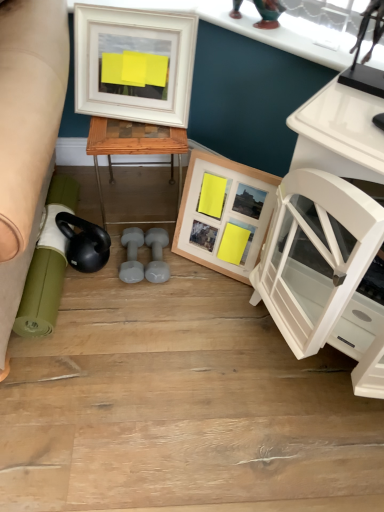
Question: From the image's perspective, is wooden picture frame at center, which is the 2th picture frame from left to right, above white glossy cabinet at right?

Choices:
 (A) yes
 (B) no

Answer: (A)

Question: Is wooden picture frame at center, which ranks as the first picture frame in bottom-to-top order, to the left of white glossy cabinet at right from the viewer's perspective?

Choices:
 (A) no
 (B) yes

Answer: (B)

Question: Does wooden picture frame at center, which ranks as the first picture frame in bottom-to-top order, come behind white glossy cabinet at right?

Choices:
 (A) no
 (B) yes

Answer: (B)

Question: Is wooden picture frame at center, which appears as the second picture frame when viewed from the top, outside white glossy cabinet at right?

Choices:
 (A) no
 (B) yes

Answer: (B)

Question: Could you tell me if wooden picture frame at center, marked as the 1th picture frame in a right-to-left arrangement, is facing white glossy cabinet at right?

Choices:
 (A) yes
 (B) no

Answer: (B)

Question: Is wooden picture frame at center, marked as the 1th picture frame in a right-to-left arrangement, surrounding white glossy cabinet at right?

Choices:
 (A) yes
 (B) no

Answer: (B)

Question: Is green rubber mat at lower left not inside white matte picture frame at upper left, which ranks as the 1th picture frame in left-to-right order?

Choices:
 (A) no
 (B) yes

Answer: (B)

Question: From a real-world perspective, is green rubber mat at lower left located higher than white matte picture frame at upper left, which is the second picture frame from bottom to top?

Choices:
 (A) no
 (B) yes

Answer: (A)

Question: Is green rubber mat at lower left taller than white matte picture frame at upper left, the first picture frame from the top?

Choices:
 (A) yes
 (B) no

Answer: (B)

Question: Could white matte picture frame at upper left, which is the second picture frame from bottom to top, be considered to be inside green rubber mat at lower left?

Choices:
 (A) no
 (B) yes

Answer: (A)

Question: Are green rubber mat at lower left and white matte picture frame at upper left, which ranks as the 1th picture frame in left-to-right order, making contact?

Choices:
 (A) no
 (B) yes

Answer: (A)

Question: Is green rubber mat at lower left oriented towards white matte picture frame at upper left, the first picture frame from the top?

Choices:
 (A) no
 (B) yes

Answer: (A)

Question: Can you confirm if wooden picture frame at center, which ranks as the first picture frame in bottom-to-top order, is smaller than woodenobject at center?

Choices:
 (A) yes
 (B) no

Answer: (A)